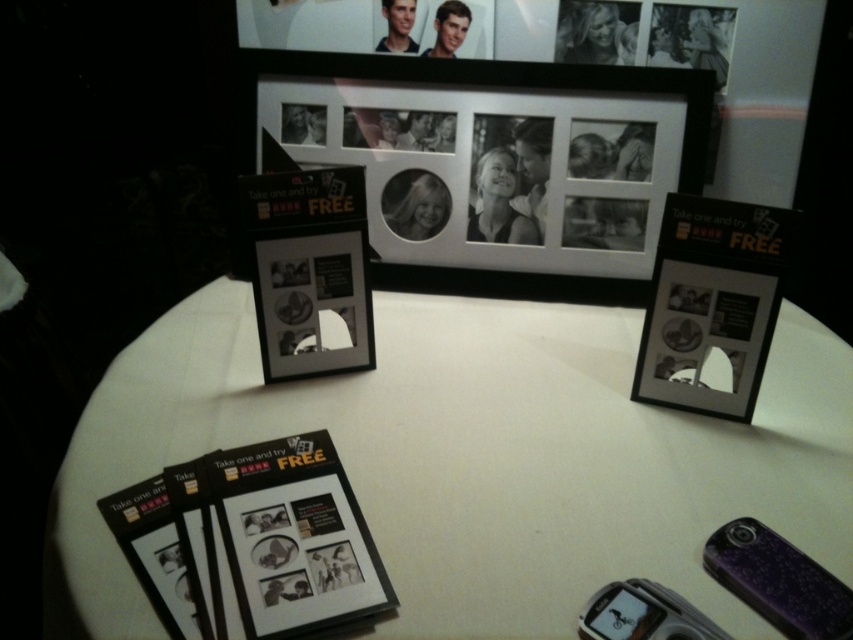
You are organizing a photography exhibition and need to arrange two frames on a table. The black matte picture frame at upper center and the matte plastic picture frame at center are both available. According to the image, which frame is located to the right of the other?

The black matte picture frame at upper center is positioned on the right side of the matte plastic picture frame at center, so it is to the right of the matte plastic picture frame at center.

You are a photographer who wants to place a new 10cm tall object on the table. The object must be placed in a position where it won not block the view of the black matte picture frame at upper center. Can the object be placed on the white matte table at center without blocking the frame?

The white matte table at center is not as tall as the black matte picture frame at upper center. Since the object is only 10cm tall, placing it on the table would not block the view of the frame as the frame is taller than the table and the object.